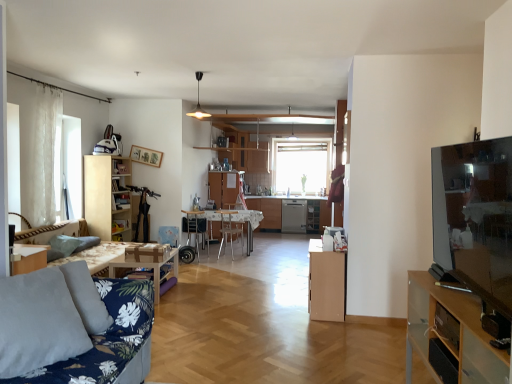
Locate an element on the screen. This screenshot has width=512, height=384. free spot to the right of wooden table at center, the 1th table in the left-to-right sequence is located at coordinates (197, 292).